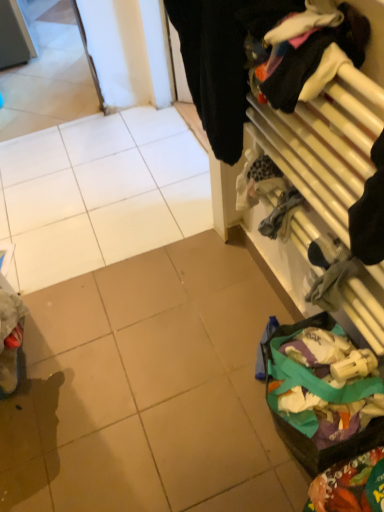
Image resolution: width=384 pixels, height=512 pixels. What are the coordinates of `multicolored fabric at lower right, which appears as the 2th waste when viewed from the back` in the screenshot? It's located at (350, 486).

At what (x,y) coordinates should I click in order to perform the action: click on multicolored fabric at lower right, the first waste positioned from the front. Please return your answer as a coordinate pair (x, y). Looking at the image, I should click on (350, 486).

From a real-world perspective, relative to wooden rack at right, is multicolored fabric at lower right, the first waste positioned from the front, vertically above or below?

multicolored fabric at lower right, the first waste positioned from the front, is situated lower than wooden rack at right in the real world.

What's the angular difference between multicolored fabric at lower right, which appears as the 2th waste when viewed from the back, and wooden rack at right's facing directions?

They differ by 0.00193 degrees in their facing directions.

Is multicolored fabric at lower right, the first waste positioned from the front, oriented towards wooden rack at right?

No, multicolored fabric at lower right, the first waste positioned from the front, is not facing towards wooden rack at right.

Which is in front, point (312, 484) or point (330, 118)?

The point (330, 118) is closer to the camera.

Can you confirm if wooden rack at right is wider than black fabric at upper right?

In fact, wooden rack at right might be narrower than black fabric at upper right.

How many degrees apart are the facing directions of wooden rack at right and black fabric at upper right?

The angular difference between wooden rack at right and black fabric at upper right is 0.002 degrees.

Considering the sizes of objects wooden rack at right and black fabric at upper right in the image provided, who is smaller, wooden rack at right or black fabric at upper right?

wooden rack at right.

Considering the positions of point (324, 97) and point (203, 7), is point (324, 97) closer or farther from the camera than point (203, 7)?

Clearly, point (324, 97) is closer to the camera than point (203, 7).

In terms of size, does multicolored fabric at lower right, which appears as the 2th waste when viewed from the back, appear bigger or smaller than multicolored fabric bag at lower right, the 2th waste from the front?

Considering their sizes, multicolored fabric at lower right, which appears as the 2th waste when viewed from the back, takes up less space than multicolored fabric bag at lower right, the 2th waste from the front.

How distant is multicolored fabric at lower right, which appears as the 2th waste when viewed from the back, from multicolored fabric bag at lower right, the 1th waste positioned from the back?

4.17 inches.

From a real-world perspective, is multicolored fabric at lower right, the first waste positioned from the front, above or below multicolored fabric bag at lower right, the 2th waste from the front?

In terms of real-world spatial position, multicolored fabric at lower right, the first waste positioned from the front, is above multicolored fabric bag at lower right, the 2th waste from the front.

Which object is closer to the camera, multicolored fabric at lower right, the first waste positioned from the front, or black fabric at upper right?

Positioned in front is black fabric at upper right.

Considering the relative positions of multicolored fabric at lower right, the first waste positioned from the front, and black fabric at upper right in the image provided, is multicolored fabric at lower right, the first waste positioned from the front, to the left of black fabric at upper right from the viewer's perspective?

No.

Is point (380, 477) closer or farther from the camera than point (233, 22)?

Point (380, 477) is farther from the camera than point (233, 22).

From a real-world perspective, count 1st wastes downward from the black fabric at upper right and point to it. Please provide its 2D coordinates.

[(350, 486)]

Could you tell me if black fabric at upper right is turned towards multicolored fabric bag at lower right, the 1th waste positioned from the back?

No.

Between black fabric at upper right and multicolored fabric bag at lower right, the 1th waste positioned from the back, which one has smaller width?

With smaller width is black fabric at upper right.

Are black fabric at upper right and multicolored fabric bag at lower right, the 1th waste positioned from the back, located far from each other?

No.

From a real-world perspective, is black fabric at upper right on top of multicolored fabric bag at lower right, the 2th waste from the front?

Yes, from a real-world perspective, black fabric at upper right is on top of multicolored fabric bag at lower right, the 2th waste from the front.

Is black fabric at upper right not inside multicolored fabric at lower right, which appears as the 2th waste when viewed from the back?

Yes, black fabric at upper right is not within multicolored fabric at lower right, which appears as the 2th waste when viewed from the back.

Is black fabric at upper right taller than multicolored fabric at lower right, which appears as the 2th waste when viewed from the back?

Indeed, black fabric at upper right has a greater height compared to multicolored fabric at lower right, which appears as the 2th waste when viewed from the back.

Is the position of black fabric at upper right more distant than that of multicolored fabric at lower right, the first waste positioned from the front?

That is False.

From a real-world perspective, which object stands above the other?

black fabric at upper right is physically above.

Image resolution: width=384 pixels, height=512 pixels. What are the coordinates of `the 1st waste below the wooden rack at right (from the image's perspective)` in the screenshot? It's located at (306, 436).

Does wooden rack at right have a lesser height compared to multicolored fabric bag at lower right, the 1th waste positioned from the back?

In fact, wooden rack at right may be taller than multicolored fabric bag at lower right, the 1th waste positioned from the back.

From the image's perspective, who appears lower, wooden rack at right or multicolored fabric bag at lower right, the 2th waste from the front?

multicolored fabric bag at lower right, the 2th waste from the front, from the image's perspective.

Locate an element on the screen. closet located in front of the multicolored fabric at lower right, the first waste positioned from the front is located at coordinates (297, 140).

Where is `clothing behind the wooden rack at right`? clothing behind the wooden rack at right is located at coordinates (222, 60).

Based on the photo, estimate the real-world distances between objects in this image. Which object is closer to wooden rack at right, multicolored fabric at lower right, the first waste positioned from the front, or multicolored fabric bag at lower right, the 2th waste from the front?

The object closer to wooden rack at right is multicolored fabric bag at lower right, the 2th waste from the front.

Considering their positions, is multicolored fabric bag at lower right, the 2th waste from the front, positioned further to multicolored fabric at lower right, which appears as the 2th waste when viewed from the back, than wooden rack at right?

Based on the image, wooden rack at right appears to be further to multicolored fabric at lower right, which appears as the 2th waste when viewed from the back.

From the image, which object appears to be farther from black fabric at upper right, multicolored fabric at lower right, which appears as the 2th waste when viewed from the back, or multicolored fabric bag at lower right, the 2th waste from the front?

Among the two, multicolored fabric at lower right, which appears as the 2th waste when viewed from the back, is located further to black fabric at upper right.

When comparing their distances from black fabric at upper right, does wooden rack at right or multicolored fabric bag at lower right, the 2th waste from the front, seem further?

Among the two, multicolored fabric bag at lower right, the 2th waste from the front, is located further to black fabric at upper right.

Looking at the image, which one is located closer to wooden rack at right, black fabric at upper right or multicolored fabric at lower right, which appears as the 2th waste when viewed from the back?

Based on the image, black fabric at upper right appears to be nearer to wooden rack at right.

Looking at the image, which one is located closer to multicolored fabric bag at lower right, the 1th waste positioned from the back, wooden rack at right or multicolored fabric at lower right, which appears as the 2th waste when viewed from the back?

multicolored fabric at lower right, which appears as the 2th waste when viewed from the back, lies closer to multicolored fabric bag at lower right, the 1th waste positioned from the back, than the other object.

From the image, which object appears to be nearer to multicolored fabric bag at lower right, the 1th waste positioned from the back, multicolored fabric at lower right, the first waste positioned from the front, or black fabric at upper right?

multicolored fabric at lower right, the first waste positioned from the front.

Considering their positions, is black fabric at upper right positioned further to multicolored fabric bag at lower right, the 1th waste positioned from the back, than multicolored fabric at lower right, which appears as the 2th waste when viewed from the back?

black fabric at upper right lies further to multicolored fabric bag at lower right, the 1th waste positioned from the back, than the other object.

You are a GUI agent. You are given a task and a screenshot of the screen. Output one action in this format:
    pyautogui.click(x=<x>, y=<y>)
    Task: Click on the waste that lies between wooden rack at right and multicolored fabric at lower right, the first waste positioned from the front, from top to bottom
    
    Given the screenshot: What is the action you would take?
    pyautogui.click(x=306, y=436)

What are the coordinates of `waste between black fabric at upper right and multicolored fabric at lower right, the first waste positioned from the front, in the up-down direction` in the screenshot? It's located at (306, 436).

The image size is (384, 512). I want to click on closet between black fabric at upper right and multicolored fabric at lower right, which appears as the 2th waste when viewed from the back, in the up-down direction, so click(x=297, y=140).

You are a GUI agent. You are given a task and a screenshot of the screen. Output one action in this format:
    pyautogui.click(x=<x>, y=<y>)
    Task: Click on the closet that lies between black fabric at upper right and multicolored fabric bag at lower right, the 2th waste from the front, from top to bottom
    
    Given the screenshot: What is the action you would take?
    pyautogui.click(x=297, y=140)